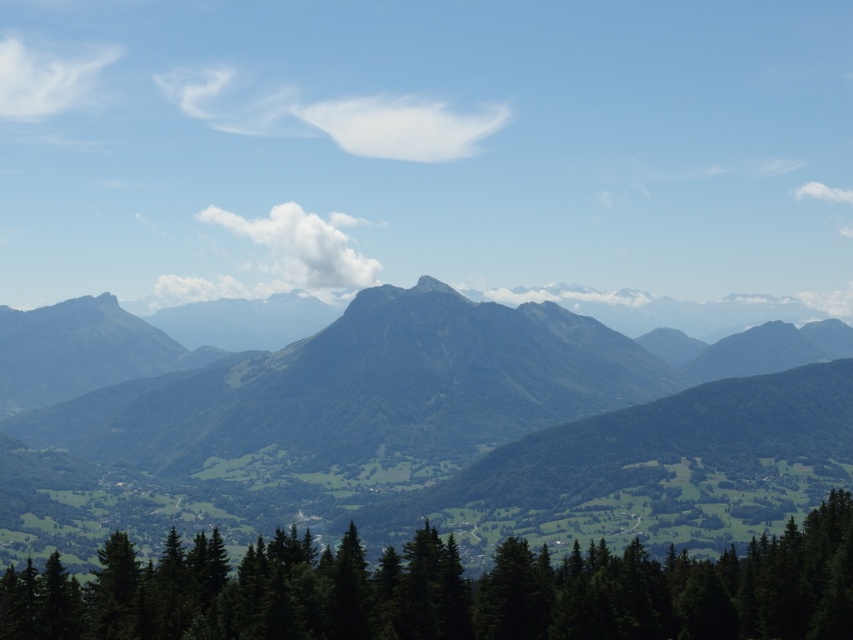
Looking at the mountainous landscape, there is a point marked at coordinates (453, 432). What does this point indicate?

The point at (453, 432) indicates the location of the green textured mountain at center.

You are an outdoor photographer planning to capture the green textured mountain at center and the green matte trees at bottom in a single shot. Based on their positions, which object will appear closer to the camera in your photograph?

The green textured mountain at center will appear closer to the camera than the green matte trees at bottom because the green matte trees at bottom are positioned behind the green textured mountain at center.

You are an outdoor enthusiast planning a hiking route. You want to start from the green matte trees at bottom and reach the green textured mountain at center. Which direction should you head towards?

You should head towards the left to reach the green textured mountain at center from the green matte trees at bottom since the mountain is positioned to the left of the trees.